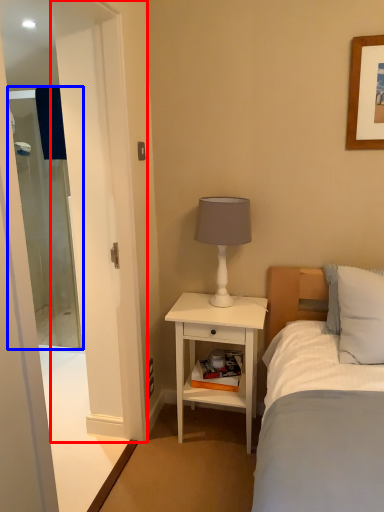
Question: Which point is further to the camera, screen door (highlighted by a red box) or screen door (highlighted by a blue box)?

Choices:
 (A) screen door
 (B) screen door

Answer: (B)